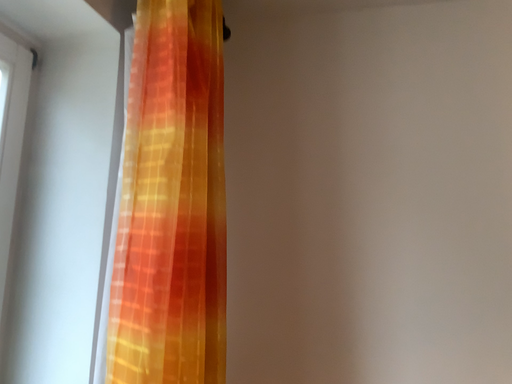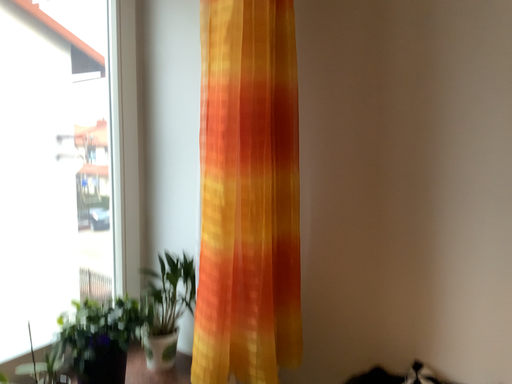
Question: Which way did the camera rotate in the video?

Choices:
 (A) rotated upward
 (B) rotated downward

Answer: (B)